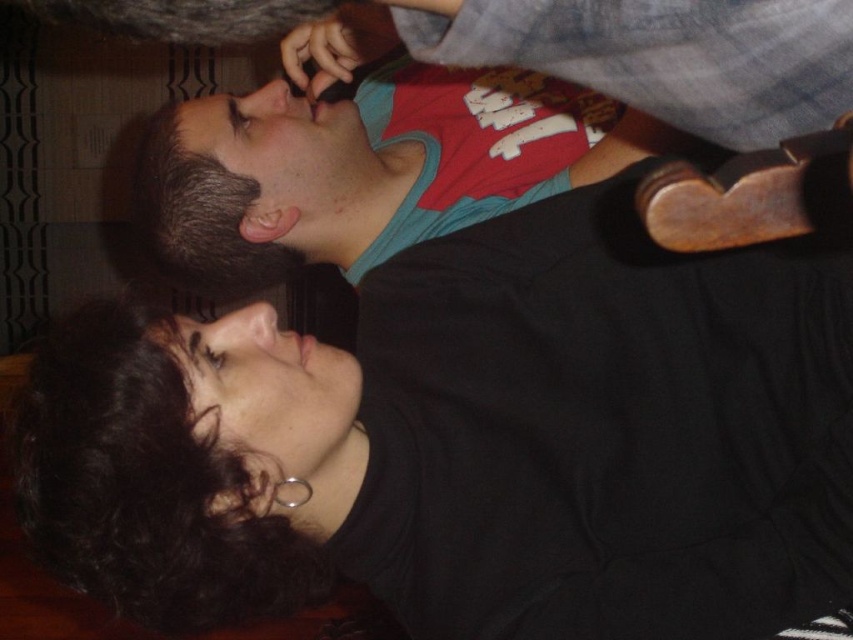
Question: Which object appears closest to the camera in this image?

Choices:
 (A) black matte shirt at upper center
 (B) matte green head at upper center
 (C) dark curly hair at lower left

Answer: (A)

Question: From the image, what is the correct spatial relationship of black matte shirt at upper center in relation to dark curly hair at lower left?

Choices:
 (A) below
 (B) above

Answer: (B)

Question: Which of these objects is positioned closest to the dark curly hair at lower left?

Choices:
 (A) black matte shirt at upper center
 (B) matte green head at upper center

Answer: (A)

Question: Does dark curly hair at lower left have a smaller size compared to matte green head at upper center?

Choices:
 (A) no
 (B) yes

Answer: (B)

Question: Considering the relative positions of dark curly hair at lower left and matte green head at upper center in the image provided, where is dark curly hair at lower left located with respect to matte green head at upper center?

Choices:
 (A) right
 (B) left

Answer: (B)

Question: Which point is closer to the camera taking this photo?

Choices:
 (A) (114, 560)
 (B) (73, 520)
 (C) (274, 136)

Answer: (B)